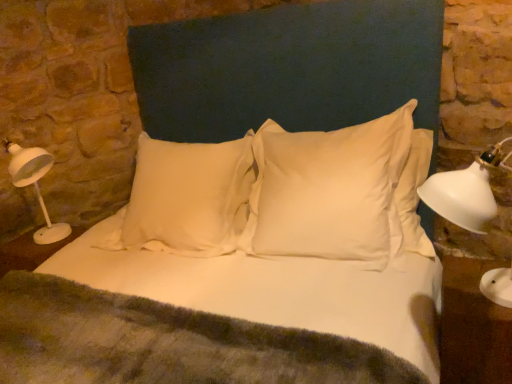
Question: In terms of width, does white satin pillow at center, marked as the second pillow in a right-to-left arrangement, look wider or thinner when compared to white glossy table at lower right?

Choices:
 (A) wide
 (B) thin

Answer: (A)

Question: From a real-world perspective, is white satin pillow at center, positioned as the first pillow in left-to-right order, positioned above or below white glossy table at lower right?

Choices:
 (A) below
 (B) above

Answer: (B)

Question: Considering the real-world distances, which object is closest to the white fabric headboard at center?

Choices:
 (A) white satin pillow at center, marked as the second pillow in a right-to-left arrangement
 (B) white smooth pillow at center, the second pillow viewed from the left
 (C) white plastic table lamp at left
 (D) white glossy table at lower right

Answer: (B)

Question: Which of these objects is positioned farthest from the white smooth pillow at center, the second pillow viewed from the left?

Choices:
 (A) white satin pillow at center, positioned as the first pillow in left-to-right order
 (B) white plastic table lamp at left
 (C) white glossy table at lower right
 (D) white fabric headboard at center

Answer: (B)